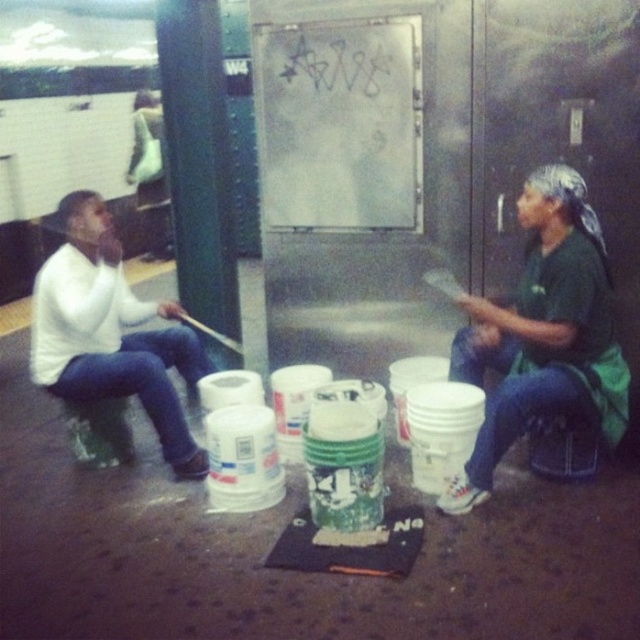
Question: Which point is farther to the camera?

Choices:
 (A) green fabric shirt at right
 (B) white matte sweater at left

Answer: (B)

Question: Which object appears closest to the camera in this image?

Choices:
 (A) green fabric shirt at right
 (B) white matte sweater at left

Answer: (A)

Question: In this image, where is green fabric shirt at right located relative to white matte sweater at left?

Choices:
 (A) left
 (B) right

Answer: (B)

Question: Considering the relative positions of green fabric shirt at right and white matte sweater at left in the image provided, where is green fabric shirt at right located with respect to white matte sweater at left?

Choices:
 (A) above
 (B) below

Answer: (B)

Question: Can you confirm if green fabric shirt at right is wider than white matte sweater at left?

Choices:
 (A) yes
 (B) no

Answer: (A)